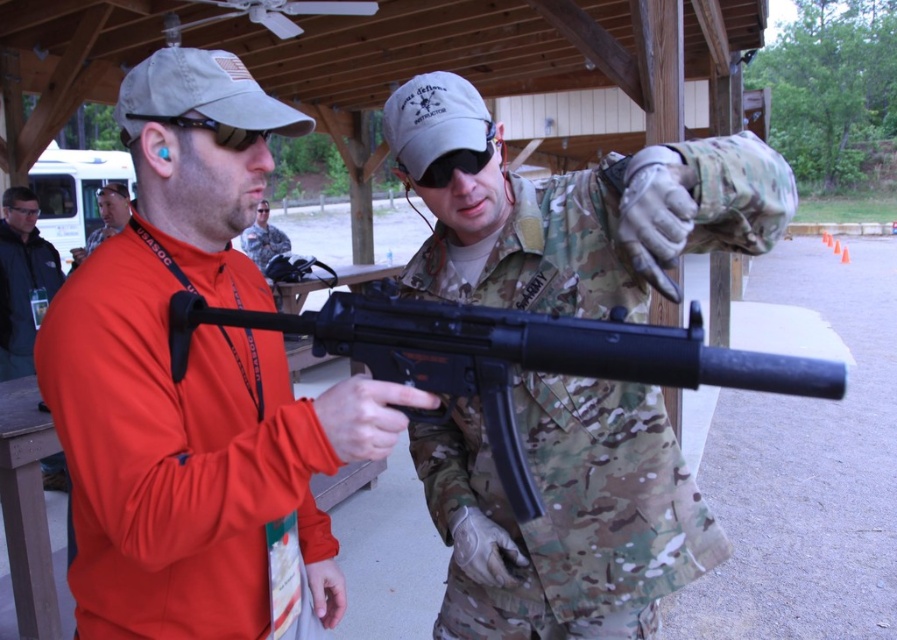
Question: Does matte black rifle at center appear under orange fabric shirt at left?

Choices:
 (A) no
 (B) yes

Answer: (B)

Question: Estimate the real-world distances between objects in this image. Which object is closer to the dark gray jacket at left?

Choices:
 (A) matte black rifle at center
 (B) black matte rifle at center

Answer: (A)

Question: Is the position of matte black rifle at center less distant than that of dark gray jacket at left?

Choices:
 (A) no
 (B) yes

Answer: (B)

Question: Can you confirm if dark gray jacket at left is thinner than camouflage uniform at center?

Choices:
 (A) yes
 (B) no

Answer: (A)

Question: Which object is positioned closest to the black matte rifle at center?

Choices:
 (A) dark gray jacket at left
 (B) matte black rifle at center
 (C) camouflage uniform at center
 (D) orange fabric shirt at left

Answer: (B)

Question: Which point is closer to the camera taking this photo?

Choices:
 (A) 646,221
 (B) 246,234
 (C) 83,426

Answer: (A)